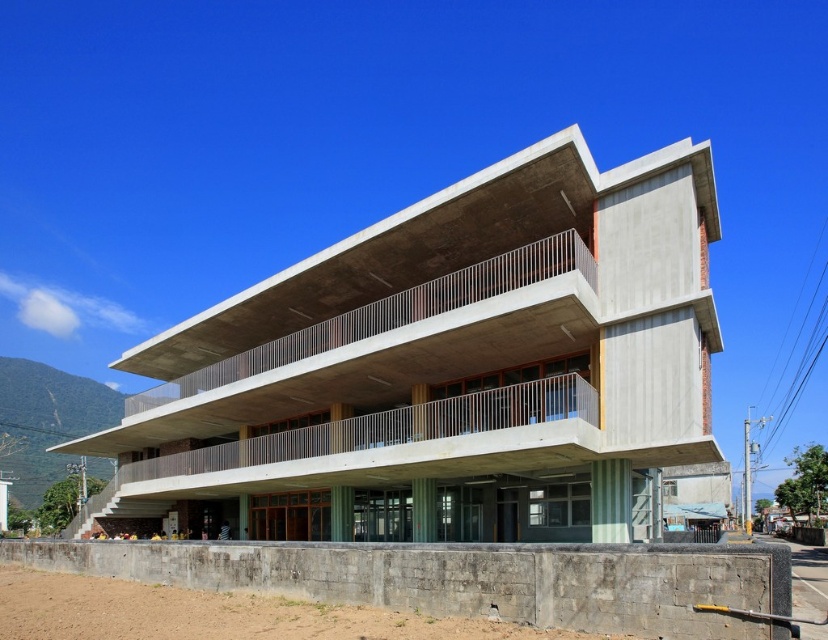
Question: Where is concrete building at center located in relation to gray concrete wall at lower center in the image?

Choices:
 (A) below
 (B) above

Answer: (B)

Question: Among these objects, which one is nearest to the camera?

Choices:
 (A) concrete building at center
 (B) gray concrete wall at lower center

Answer: (B)

Question: Can you confirm if concrete building at center is positioned above gray concrete wall at lower center?

Choices:
 (A) yes
 (B) no

Answer: (A)

Question: Observing the image, what is the correct spatial positioning of concrete building at center in reference to gray concrete wall at lower center?

Choices:
 (A) right
 (B) left

Answer: (B)